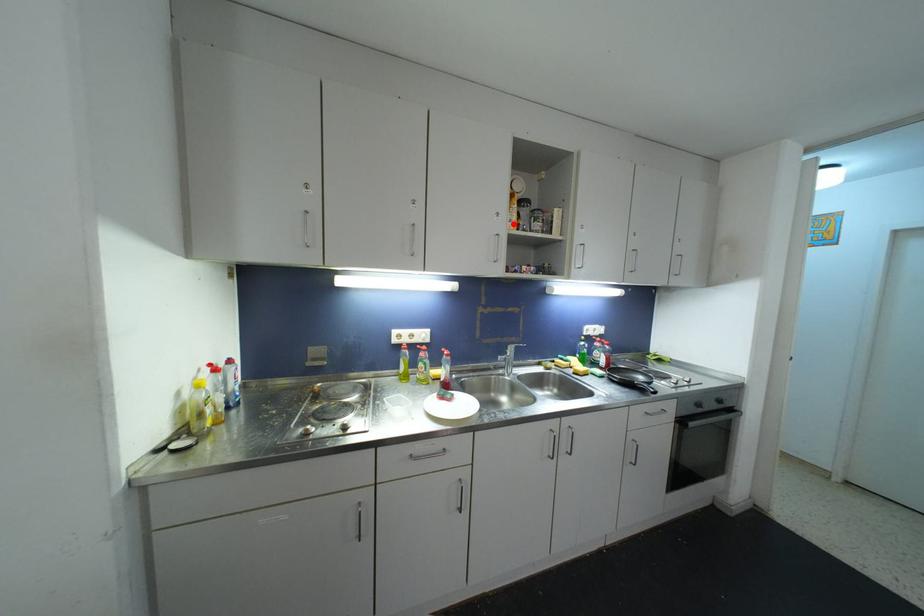
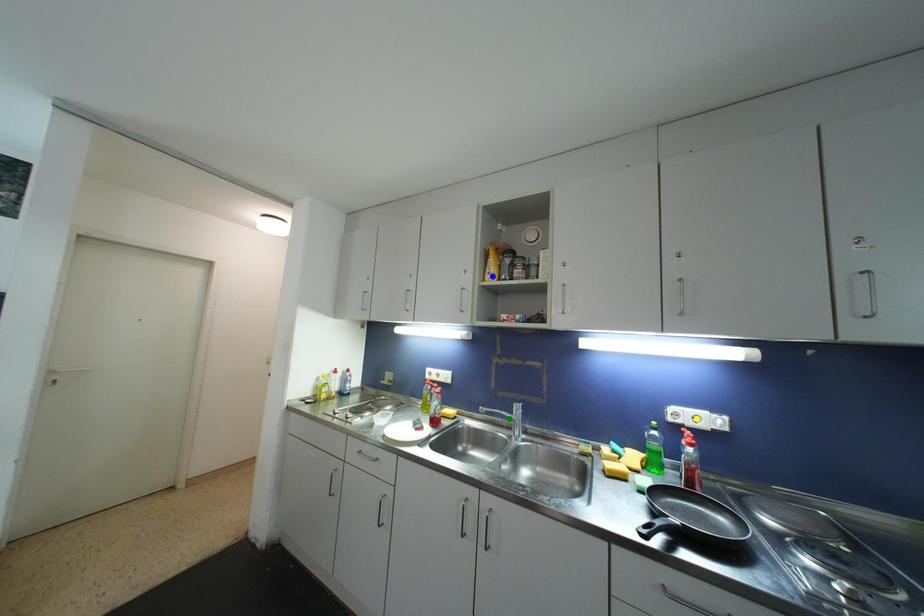
Question: I am providing you with two images of the same scene from different viewpoints. A red point is marked on the first image. You are given multiple points on the second image. Which mark in image 2 goes with the point in image 1?

Choices:
 (A) blue point
 (B) green point
 (C) yellow point

Answer: (A)